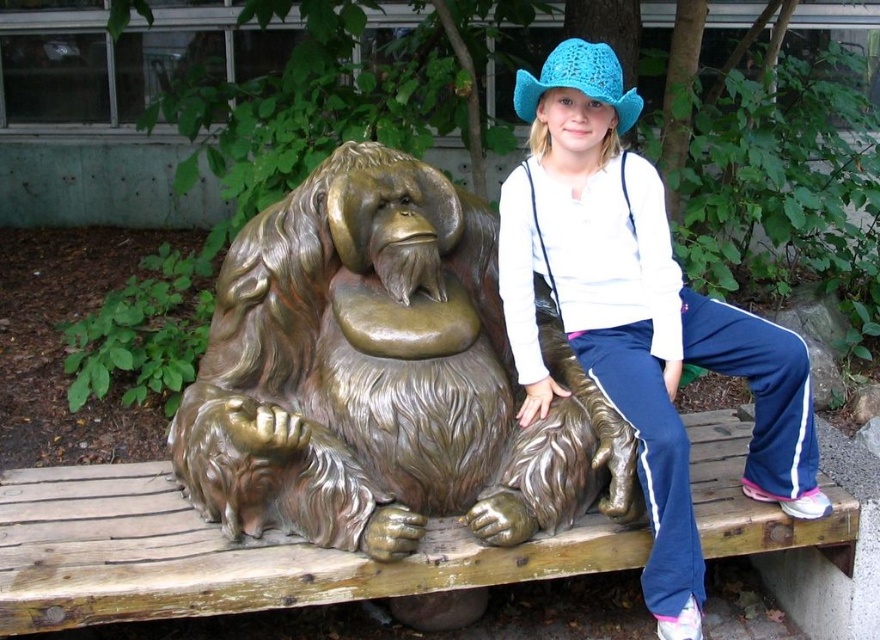
You are a photographer trying to capture both the bronze statue at center and the blue knitted hat at upper right in a single frame. Given that the statue is larger, will you need to adjust your camera position to ensure both are visible?

The bronze statue at center is bigger than the blue knitted hat at upper right. To ensure both are visible in the frame, you may need to adjust your camera position to include the entire statue while still capturing the hat, possibly by moving back slightly or using a wider lens.

You are a photographer trying to capture both the bronze statue at center and the crochet blue hat at upper right in the same frame. Since you want to ensure both are visible, which object should you focus on first to avoid missing either in your shot?

The bronze statue at center is taller than the crochet blue hat at upper right, so you should focus on framing the bronze statue at center first to ensure it fits within the shot, as it is larger and might require more space.

You are a photographer trying to capture both the bronze statue at center and the crochet blue hat at upper right in the same frame. Based on their positions, which object should you focus on first to ensure both are in focus?

The bronze statue at center is in front of the crochet blue hat at upper right, so you should focus on the bronze statue at center first to ensure both are in focus.